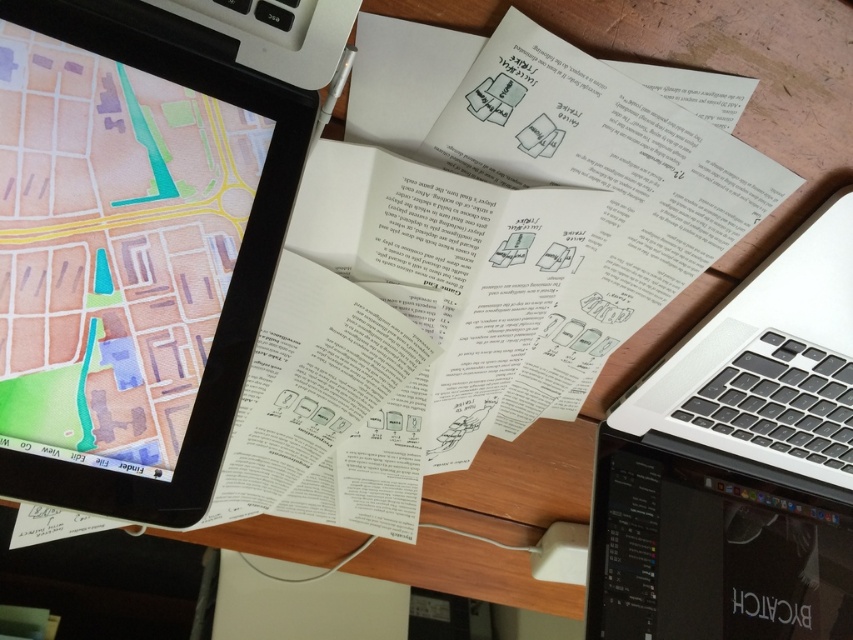
Is point (822, 556) in front of point (810, 275)?

No, (822, 556) is behind (810, 275).

Based on the photo, who is positioned more to the left, black glossy tablet at lower right or silver metallic laptop at right?

silver metallic laptop at right

Is point (650, 499) positioned before point (845, 419)?

No.

Identify the location of black glossy tablet at lower right. This screenshot has height=640, width=853. (712, 545).

Locate an element on the screen. The image size is (853, 640). black glossy tablet at upper left is located at coordinates (131, 253).

Is point (302, 131) positioned after point (691, 637)?

No.

The width and height of the screenshot is (853, 640). Identify the location of black glossy tablet at upper left. (131, 253).

The image size is (853, 640). I want to click on black glossy tablet at upper left, so click(131, 253).

Between black glossy tablet at upper left and silver metallic laptop at right, which one appears on the right side from the viewer's perspective?

From the viewer's perspective, silver metallic laptop at right appears more on the right side.

This screenshot has width=853, height=640. What do you see at coordinates (131, 253) in the screenshot?
I see `black glossy tablet at upper left` at bounding box center [131, 253].

Find the location of `black glossy tablet at upper left`. black glossy tablet at upper left is located at coordinates (131, 253).